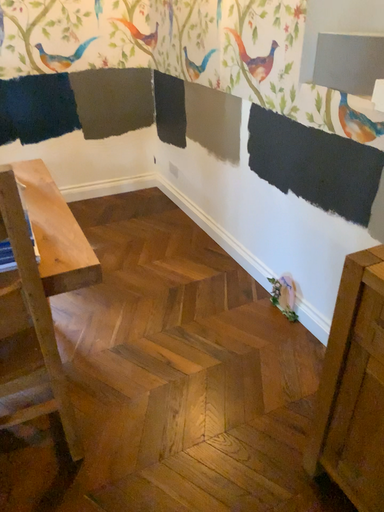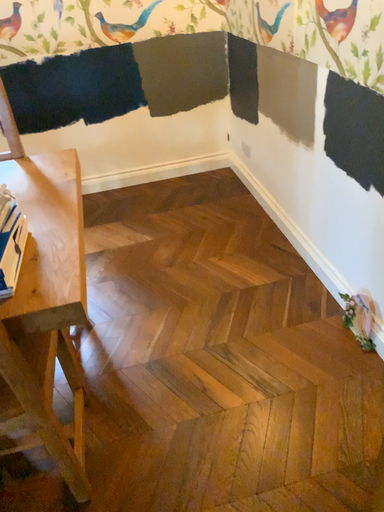
Question: Which way did the camera rotate in the video?

Choices:
 (A) rotated left
 (B) rotated right

Answer: (A)